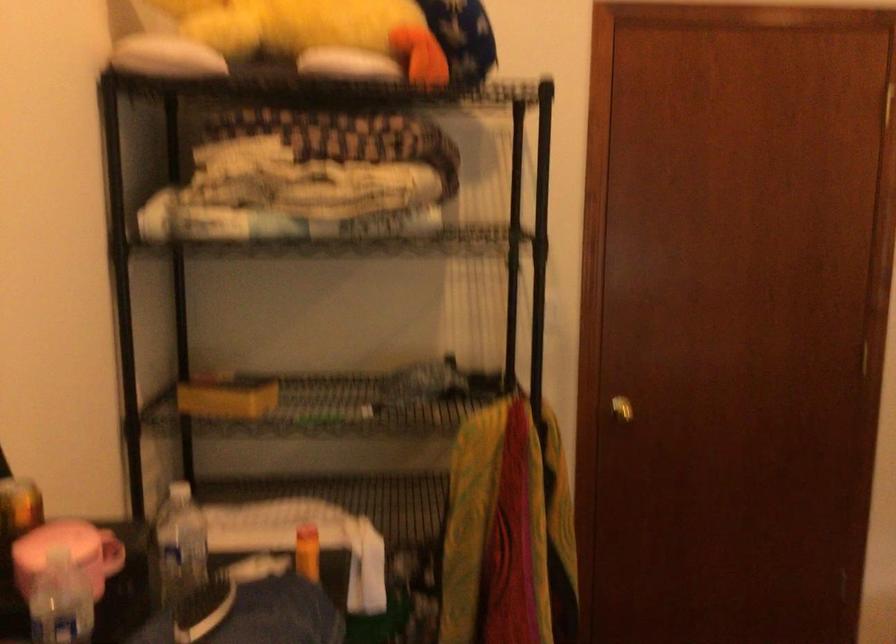
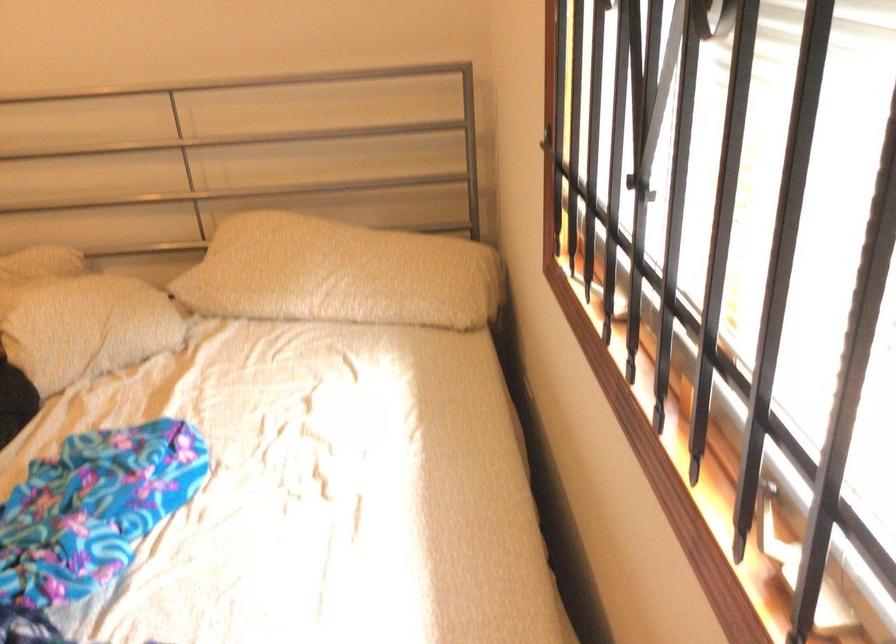
Based on the continuous images, in which direction is the camera rotating?

The camera rotated toward right-down.